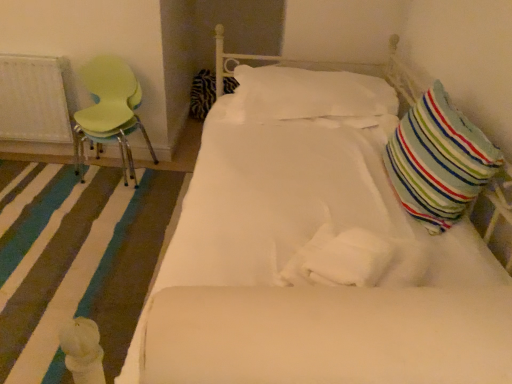
This screenshot has width=512, height=384. What are the coordinates of `vacant space to the right of light green plastic chair at left` in the screenshot? It's located at (164, 189).